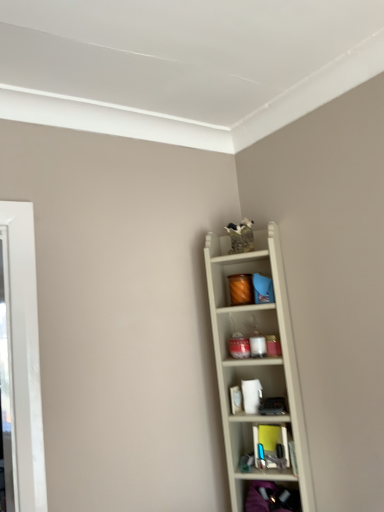
Question: Does matte black shoes at lower right, the second shelf from the top, have a lesser height compared to white wood shelf at upper right, the first shelf in the top-to-bottom sequence?

Choices:
 (A) no
 (B) yes

Answer: (B)

Question: Considering the relative positions of matte black shoes at lower right, the 1th shelf in the bottom-to-top sequence, and white wood shelf at upper right, the 2th shelf ordered from the bottom, in the image provided, is matte black shoes at lower right, the 1th shelf in the bottom-to-top sequence, behind white wood shelf at upper right, the 2th shelf ordered from the bottom,?

Choices:
 (A) yes
 (B) no

Answer: (B)

Question: Is white wood shelf at upper right, the 2th shelf ordered from the bottom, inside matte black shoes at lower right, the 1th shelf in the bottom-to-top sequence?

Choices:
 (A) yes
 (B) no

Answer: (B)

Question: Can you confirm if matte black shoes at lower right, the 1th shelf in the bottom-to-top sequence, is thinner than white wood shelf at upper right, the first shelf in the top-to-bottom sequence?

Choices:
 (A) no
 (B) yes

Answer: (A)

Question: Is matte black shoes at lower right, the 1th shelf in the bottom-to-top sequence, positioned before white wood shelf at upper right, the first shelf in the top-to-bottom sequence?

Choices:
 (A) yes
 (B) no

Answer: (A)

Question: From the image's perspective, would you say matte black shoes at lower right, the 1th shelf in the bottom-to-top sequence, is shown under white wood shelf at upper right, the 2th shelf ordered from the bottom?

Choices:
 (A) yes
 (B) no

Answer: (A)

Question: Considering the relative positions of white wood shelf at upper right, the 2th shelf ordered from the bottom, and matte black shoes at lower right, the 1th shelf in the bottom-to-top sequence, in the image provided, is white wood shelf at upper right, the 2th shelf ordered from the bottom, to the left of matte black shoes at lower right, the 1th shelf in the bottom-to-top sequence, from the viewer's perspective?

Choices:
 (A) no
 (B) yes

Answer: (B)

Question: Is white wood shelf at upper right, the first shelf in the top-to-bottom sequence, shorter than matte black shoes at lower right, the 1th shelf in the bottom-to-top sequence?

Choices:
 (A) no
 (B) yes

Answer: (A)

Question: From the image's perspective, is white wood shelf at upper right, the first shelf in the top-to-bottom sequence, located beneath matte black shoes at lower right, the 1th shelf in the bottom-to-top sequence?

Choices:
 (A) yes
 (B) no

Answer: (B)

Question: Is white wood shelf at upper right, the first shelf in the top-to-bottom sequence, far from matte black shoes at lower right, the 1th shelf in the bottom-to-top sequence?

Choices:
 (A) no
 (B) yes

Answer: (A)

Question: From a real-world perspective, is white wood shelf at upper right, the first shelf in the top-to-bottom sequence, positioned under matte black shoes at lower right, the second shelf from the top, based on gravity?

Choices:
 (A) no
 (B) yes

Answer: (A)

Question: Is white wood shelf at upper right, the 2th shelf ordered from the bottom, oriented towards matte black shoes at lower right, the second shelf from the top?

Choices:
 (A) no
 (B) yes

Answer: (B)

Question: Is white wood shelf at upper right, the 2th shelf ordered from the bottom, bigger or smaller than matte black shoes at lower right, the 1th shelf in the bottom-to-top sequence?

Choices:
 (A) big
 (B) small

Answer: (A)